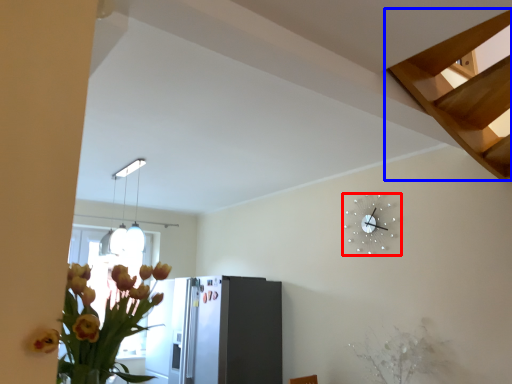
Question: Which of the following is the farthest to the observer, wall clock (highlighted by a red box) or stairs (highlighted by a blue box)?

Choices:
 (A) wall clock
 (B) stairs

Answer: (A)